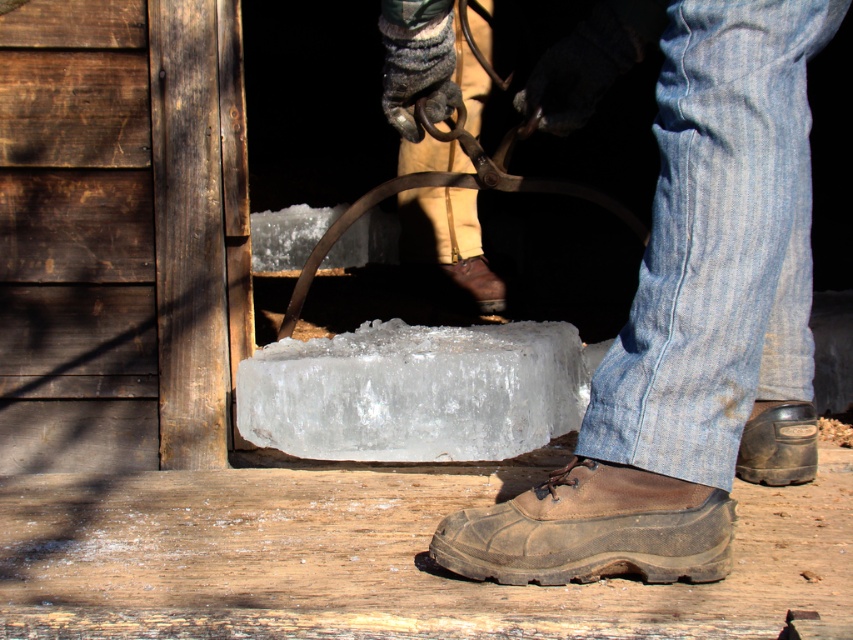
Question: Does denim at lower right come behind brown suede shoe at lower center?

Choices:
 (A) yes
 (B) no

Answer: (B)

Question: Considering the real-world distances, which object is farthest from the brown suede shoe at lower center?

Choices:
 (A) brown leather shoe at center
 (B) brown leather shoe at lower right
 (C) denim at lower right

Answer: (A)

Question: Which point is closer to the camera?

Choices:
 (A) brown leather shoe at lower right
 (B) brown leather shoe at center

Answer: (A)

Question: Which point appears farthest from the camera in this image?

Choices:
 (A) (469, 518)
 (B) (456, 264)
 (C) (779, 449)
 (D) (741, 36)

Answer: (B)

Question: From the image, what is the correct spatial relationship of brown suede shoe at lower center in relation to brown leather shoe at lower right?

Choices:
 (A) above
 (B) below

Answer: (B)

Question: Does denim at lower right have a larger size compared to brown leather shoe at lower right?

Choices:
 (A) no
 (B) yes

Answer: (B)